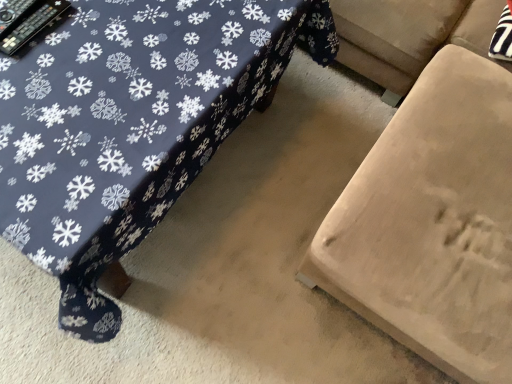
Question: Is dark blue fabric table at center looking in the opposite direction of beige fabric ottoman at lower right?

Choices:
 (A) no
 (B) yes

Answer: (A)

Question: Could beige fabric ottoman at lower right be considered to be inside dark blue fabric table at center?

Choices:
 (A) yes
 (B) no

Answer: (B)

Question: From a real-world perspective, is dark blue fabric table at center below beige fabric ottoman at lower right?

Choices:
 (A) yes
 (B) no

Answer: (A)

Question: Considering the relative sizes of dark blue fabric table at center and beige fabric ottoman at lower right in the image provided, is dark blue fabric table at center thinner than beige fabric ottoman at lower right?

Choices:
 (A) no
 (B) yes

Answer: (A)

Question: Does dark blue fabric table at center have a lesser height compared to beige fabric ottoman at lower right?

Choices:
 (A) yes
 (B) no

Answer: (A)

Question: From the image's perspective, is dark blue fabric table at center located beneath beige fabric ottoman at lower right?

Choices:
 (A) no
 (B) yes

Answer: (A)

Question: Is beige fabric ottoman at lower right thinner than dark blue fabric table at center?

Choices:
 (A) yes
 (B) no

Answer: (A)

Question: Are beige fabric ottoman at lower right and dark blue fabric table at center making contact?

Choices:
 (A) no
 (B) yes

Answer: (A)

Question: Is beige fabric ottoman at lower right to the left of dark blue fabric table at center from the viewer's perspective?

Choices:
 (A) no
 (B) yes

Answer: (A)

Question: From the image's perspective, is beige fabric ottoman at lower right beneath dark blue fabric table at center?

Choices:
 (A) no
 (B) yes

Answer: (B)

Question: Are beige fabric ottoman at lower right and dark blue fabric table at center located far from each other?

Choices:
 (A) yes
 (B) no

Answer: (B)

Question: Considering the relative positions of beige fabric ottoman at lower right and dark blue fabric table at center in the image provided, is beige fabric ottoman at lower right to the right of dark blue fabric table at center from the viewer's perspective?

Choices:
 (A) no
 (B) yes

Answer: (B)

Question: From the image's perspective, relative to beige fabric ottoman at lower right, is dark blue fabric table at center above or below?

Choices:
 (A) below
 (B) above

Answer: (B)